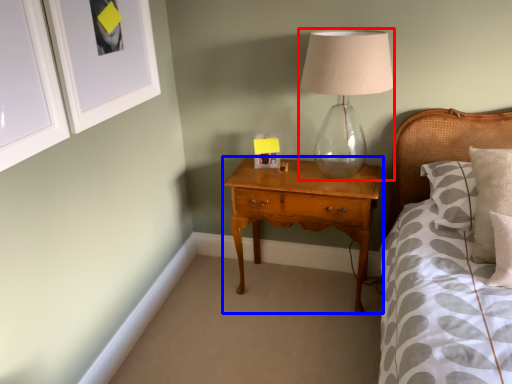
Question: Which object appears closest to the camera in this image, table lamp (highlighted by a red box) or nightstand (highlighted by a blue box)?

Choices:
 (A) table lamp
 (B) nightstand

Answer: (A)